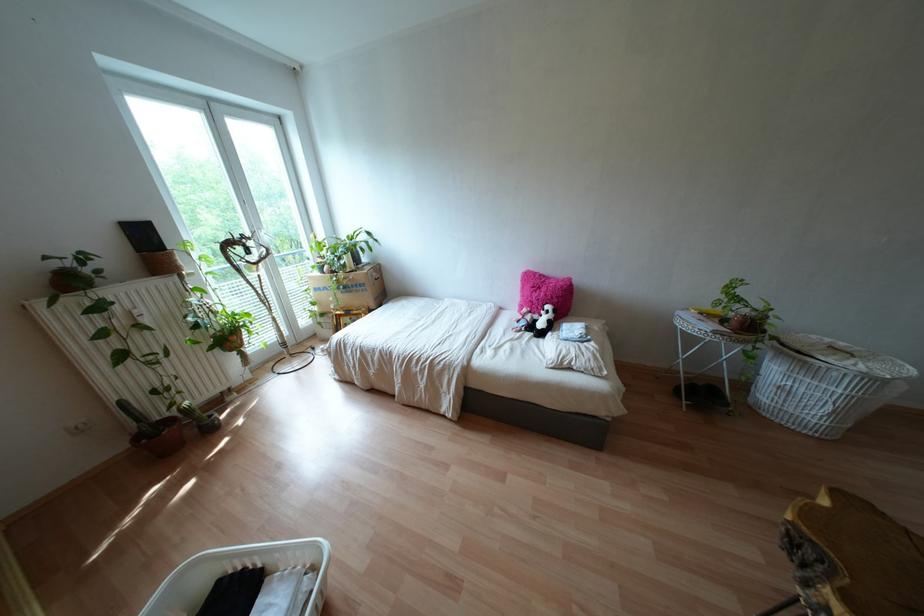
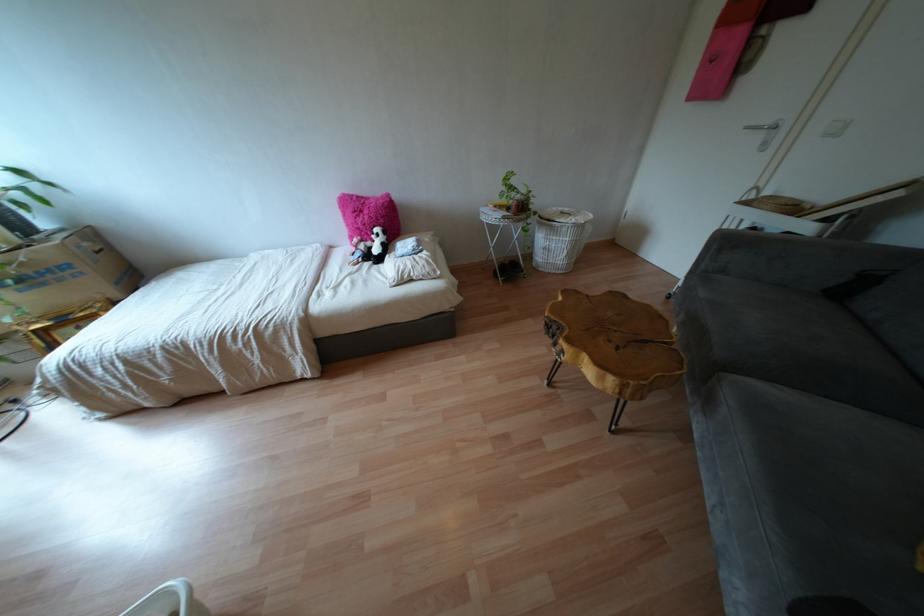
The point at (551, 326) is marked in the first image. Where is the corresponding point in the second image?

(385, 248)